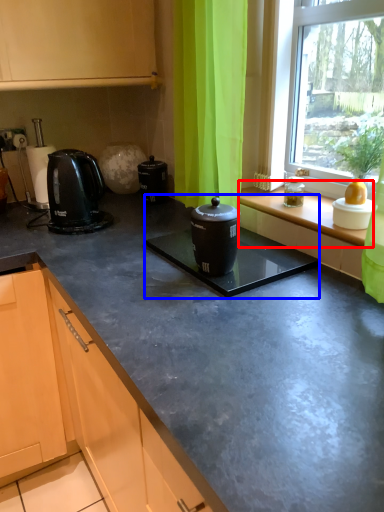
Question: Which point is closer to the camera, window sill (highlighted by a red box) or sink (highlighted by a blue box)?

Choices:
 (A) window sill
 (B) sink

Answer: (B)